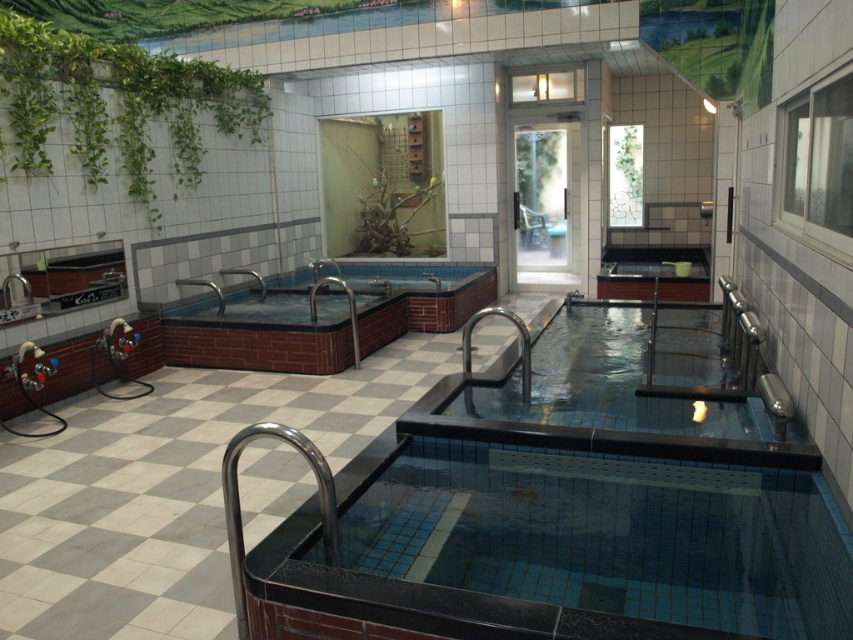
You are designing a layout for a spa and want to place a new small decorative item between the green leafy plant at upper left and the green leafy plant at upper center. Considering their sizes, which plant should the decorative item be closer to?

The green leafy plant at upper left is larger in size than the green leafy plant at upper center. Therefore, the decorative item should be placed closer to the smaller green leafy plant at upper center to balance the visual weight.

You are a maintenance worker needing to service both the blue mosaic tile swimming pool at center and the blue ceramic jacuzzi at center. The service cart you are using is 1.5 meters wide. Can you move the cart between the two facilities without hitting either?

The blue mosaic tile swimming pool at center and blue ceramic jacuzzi at center are 3.05 meters apart from each other. Since the service cart is 1.5 meters wide, there is enough space between the two facilities to maneuver the cart safely without any collisions.